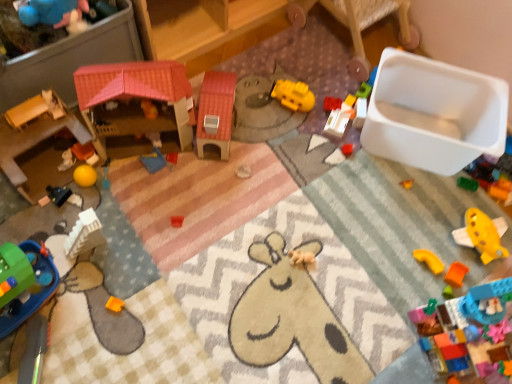
Locate an element on the screen. free area in between orange matte block at lower right, which ranks as the second toy in right-to-left order, and translucent blue plastic blocks at lower right, the thirteenth toy viewed from the left is located at coordinates (434, 290).